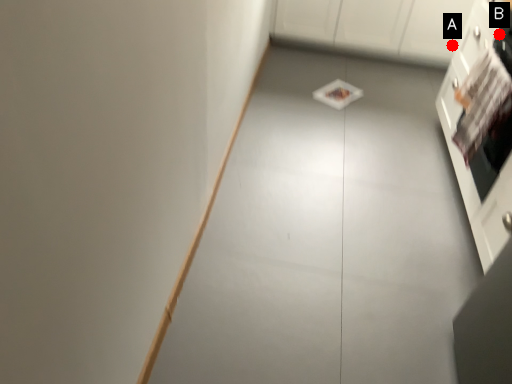
Question: Two points are circled on the image, labeled by A and B beside each circle. Which point is closer to the camera?

Choices:
 (A) A is closer
 (B) B is closer

Answer: (B)